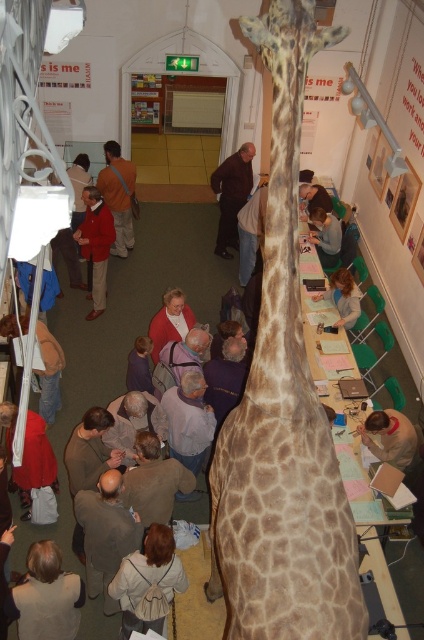
From the picture: You are a participant in the event and need to retrieve your belongings from the coat rack. You see the brown wool sweater at lower center and the light brown leather jacket at lower right. Which item is closer to you?

The brown wool sweater at lower center is closer to you because it is in front of the light brown leather jacket at lower right.

You are organizing a school event and need to place a 1.5 meter tall banner between the spotted fur giraffe at center and the light brown backpack at lower center. Can the banner fit vertically between them based on their heights?

The spotted fur giraffe at center is taller than the light brown backpack at lower center. Since the banner is 1.5 meters tall, it can only fit vertically if the giraffe is at least 1.5 meters tall. However, without knowing the exact height of the giraffe, we cannot confirm if the banner will fit.